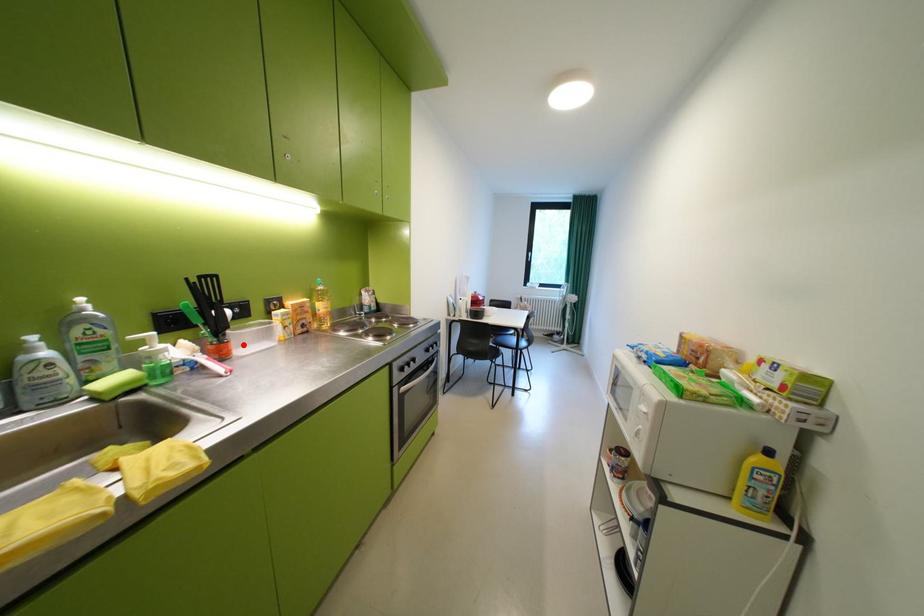
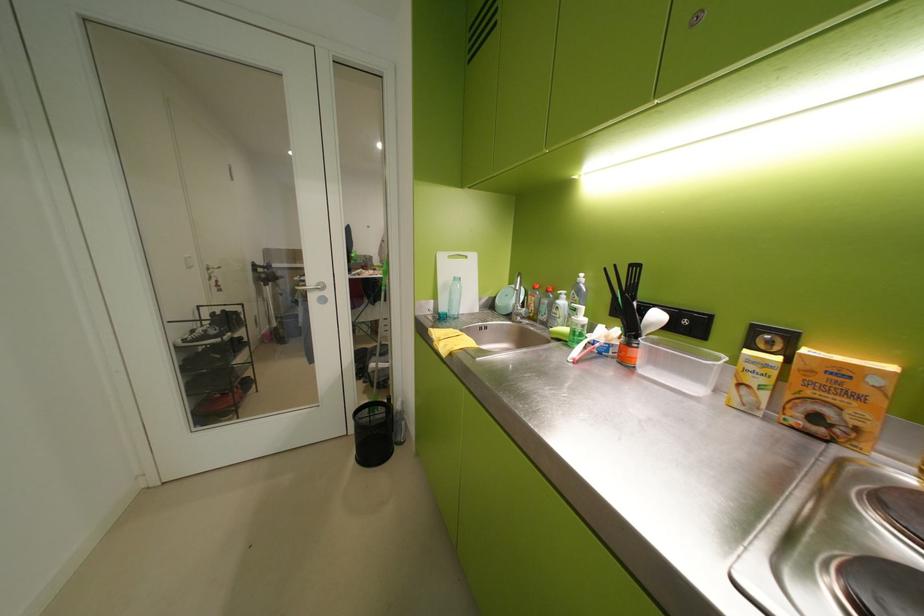
Question: I am providing you with two images of the same scene from different viewpoints. A red point is marked on the first image. Can you still see the location of the red point in image 2?

Choices:
 (A) Yes
 (B) No

Answer: (A)